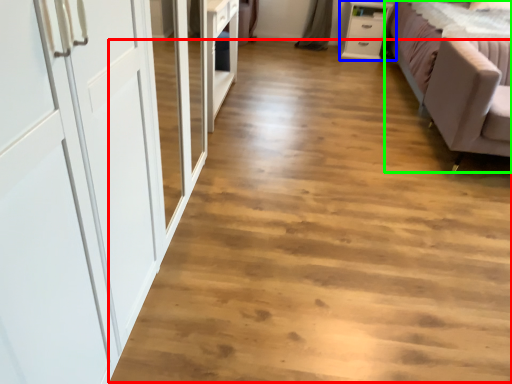
Question: Considering the real-world distances, which object is farthest from plain (highlighted by a red box)? chest of drawers (highlighted by a blue box) or studio couch (highlighted by a green box)?

Choices:
 (A) chest of drawers
 (B) studio couch

Answer: (A)